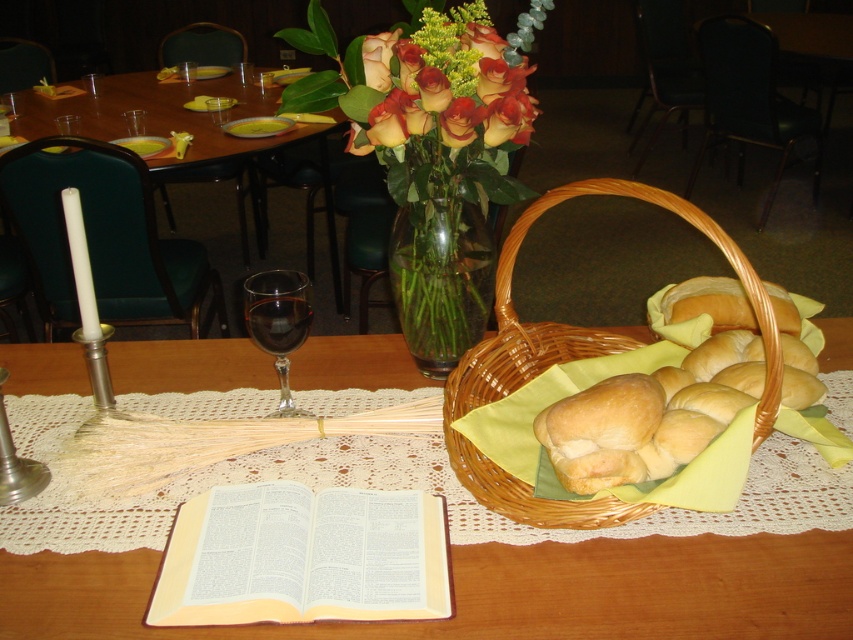
You are standing at the entrance of the room and want to place a centerpiece on the matte wooden table at center. Based on the coordinates provided, where exactly should you position the centerpiece?

The matte wooden table at center is located at point (502, 592), so you should position the centerpiece at those coordinates to ensure it is centered on the table.